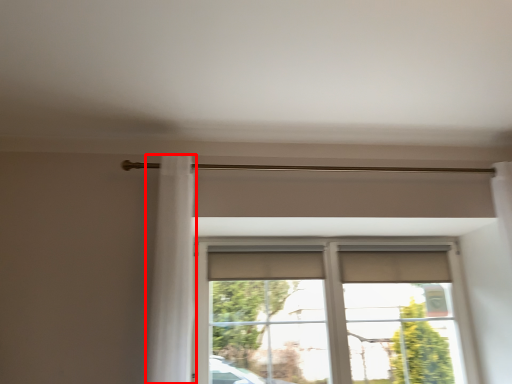
Question: From the image's perspective, what is the correct spatial relationship of shower curtain (annotated by the red box) in relation to window?

Choices:
 (A) below
 (B) above

Answer: (B)